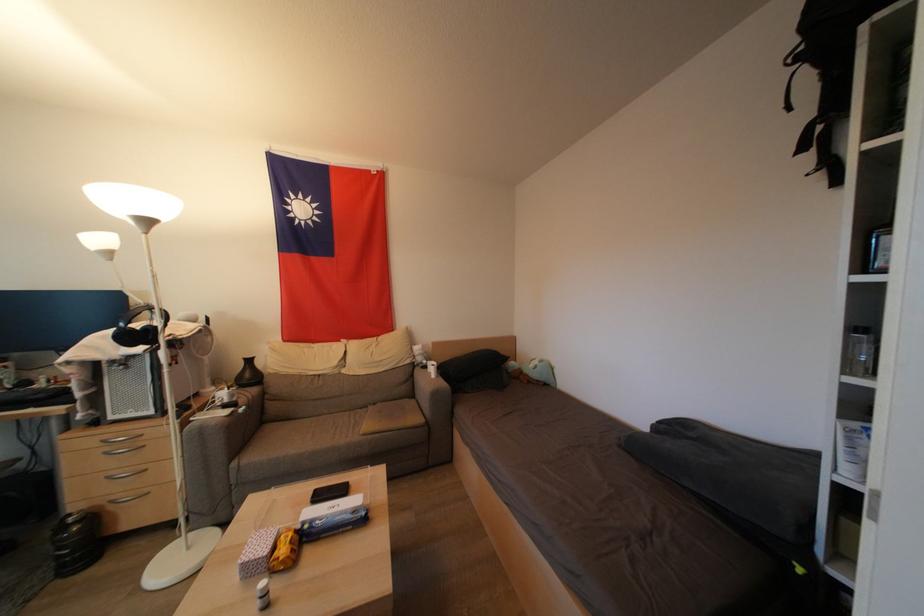
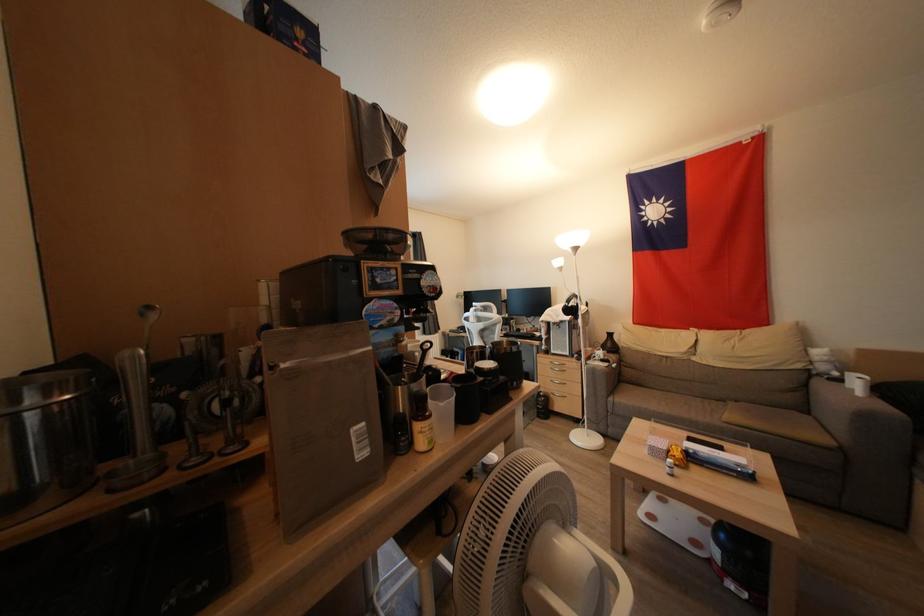
Question: The camera is either moving clockwise (left) or counter-clockwise (right) around the object. The first image is from the beginning of the video and the second image is from the end. Is the camera moving left or right when shooting the video?

Choices:
 (A) Left
 (B) Right

Answer: (B)